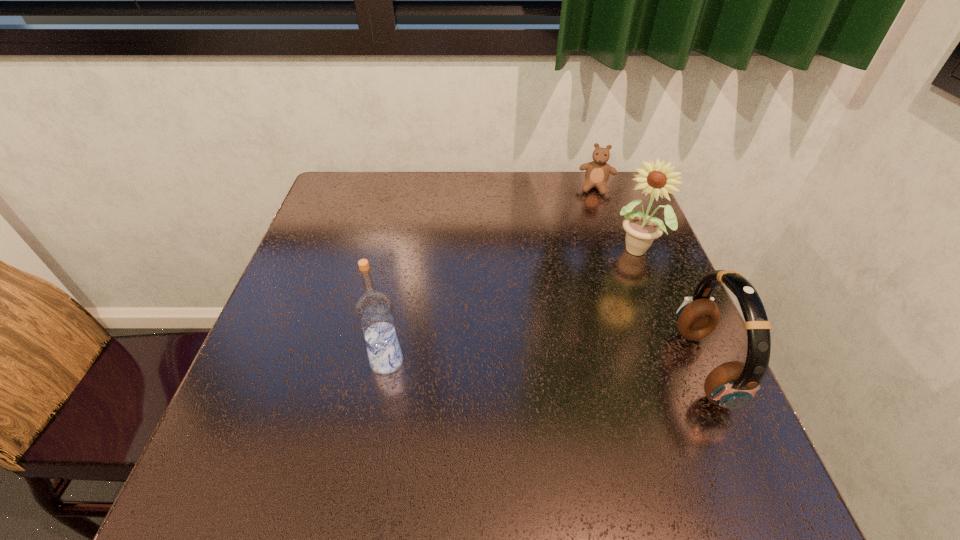
Where is `object positioned at the far right corner`? This screenshot has width=960, height=540. object positioned at the far right corner is located at coordinates click(597, 172).

I want to click on object located at the near right corner, so click(x=732, y=385).

You are a GUI agent. You are given a task and a screenshot of the screen. Output one action in this format:
    pyautogui.click(x=<x>, y=<y>)
    Task: Click on the free region at the far edge of the desktop
    This screenshot has width=960, height=540.
    Given the screenshot: What is the action you would take?
    pyautogui.click(x=528, y=215)

Locate an element on the screen. Image resolution: width=960 pixels, height=540 pixels. vacant area at the near edge is located at coordinates (627, 436).

In the image, there is a desktop. Where is `vacant area at the left edge`? The width and height of the screenshot is (960, 540). vacant area at the left edge is located at coordinates (290, 282).

This screenshot has height=540, width=960. In the image, there is a desktop. In order to click on free space at the right edge in this screenshot , I will do tap(641, 295).

This screenshot has height=540, width=960. In the image, there is a desktop. What are the coordinates of `vacant space at the far right corner` in the screenshot? It's located at click(x=622, y=195).

Where is `free space between the third tallest object and the farthest object`? The image size is (960, 540). free space between the third tallest object and the farthest object is located at coordinates (650, 278).

Where is `empty space between the second farthest object and the farthest object`? empty space between the second farthest object and the farthest object is located at coordinates (616, 219).

In order to click on empty space that is in between the second farthest object and the headset in this screenshot , I will do `click(669, 308)`.